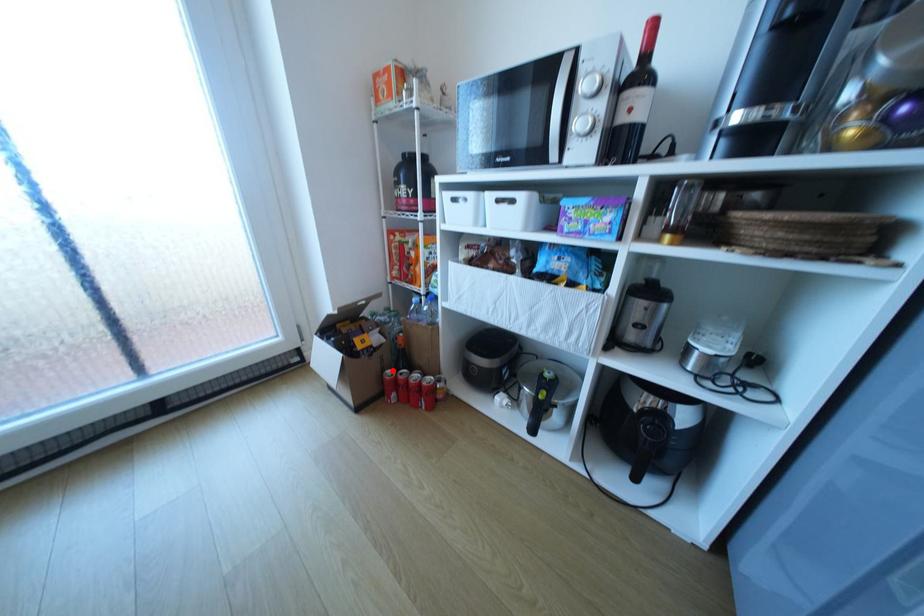
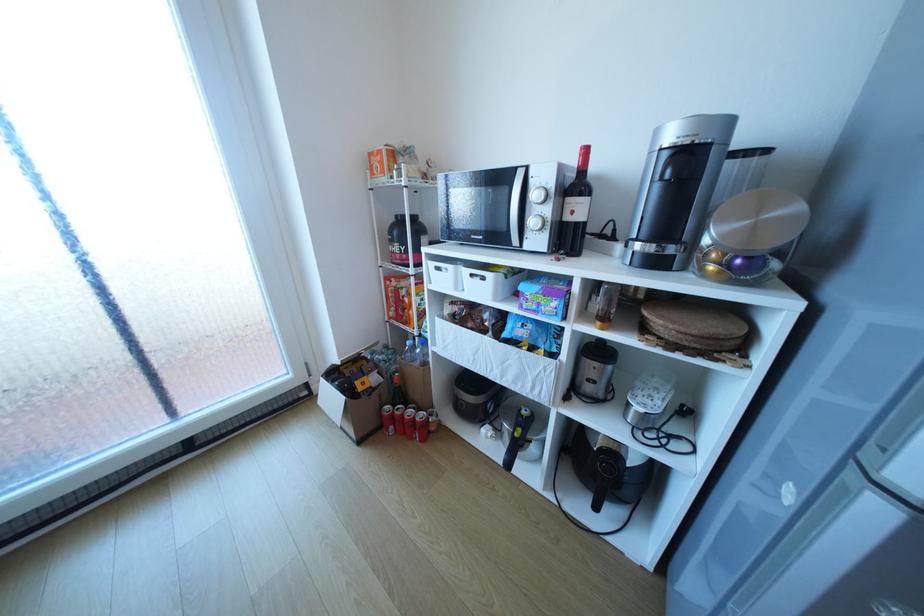
Locate, in the second image, the point that corresponds to the highlighted location in the first image.

(391, 407)